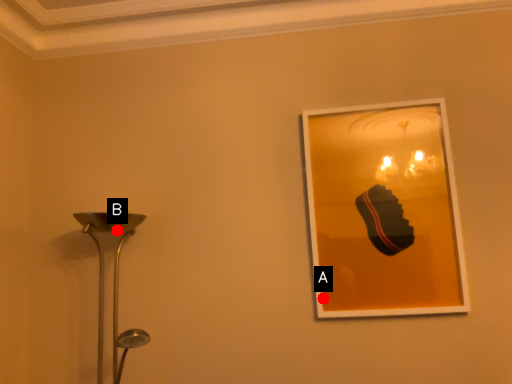
Question: Two points are circled on the image, labeled by A and B beside each circle. Which point is further to the camera?

Choices:
 (A) A is further
 (B) B is further

Answer: (A)